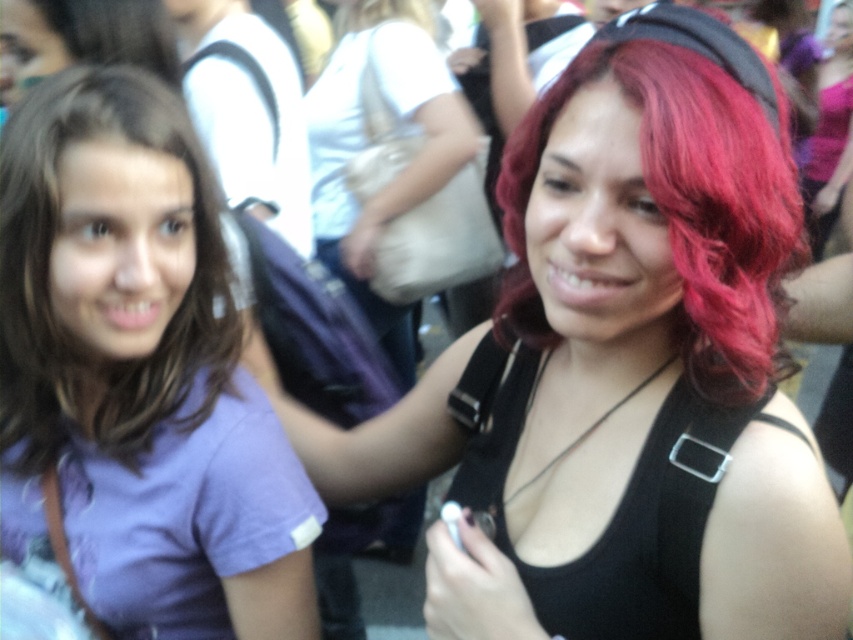
Question: Among these objects, which one is nearest to the camera?

Choices:
 (A) purple cotton shirt at left
 (B) vivid red hair at center
 (C) shiny red hair at center

Answer: (B)

Question: Which of these objects is positioned farthest from the shiny red hair at center?

Choices:
 (A) purple cotton shirt at left
 (B) vivid red hair at center

Answer: (A)

Question: Does shiny red hair at center appear under vivid red hair at center?

Choices:
 (A) no
 (B) yes

Answer: (B)

Question: Among these points, which one is farthest from the camera?

Choices:
 (A) tap(61, 451)
 (B) tap(804, 472)

Answer: (A)

Question: Can you confirm if shiny red hair at center is positioned below purple cotton shirt at left?

Choices:
 (A) yes
 (B) no

Answer: (A)

Question: In this image, where is shiny red hair at center located relative to purple cotton shirt at left?

Choices:
 (A) above
 (B) below

Answer: (B)